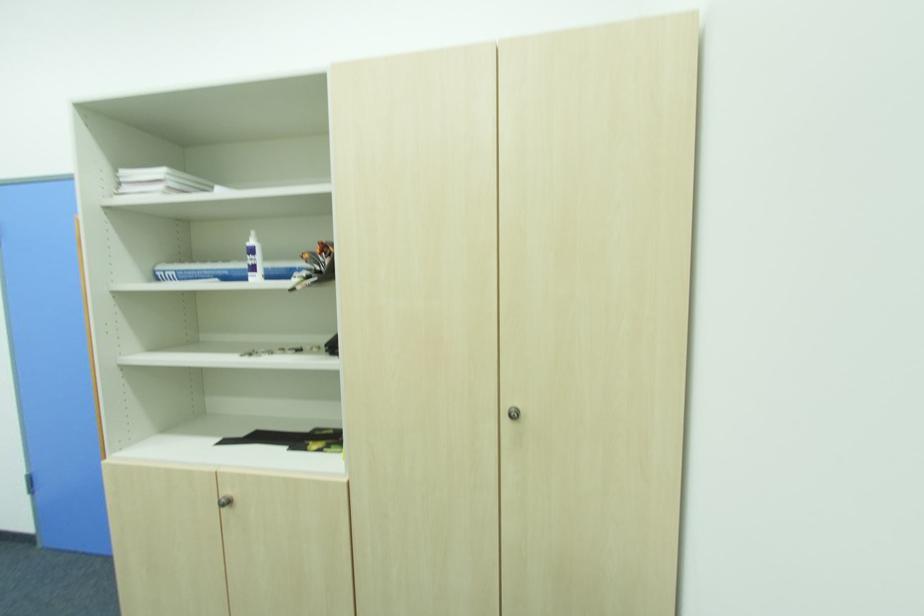
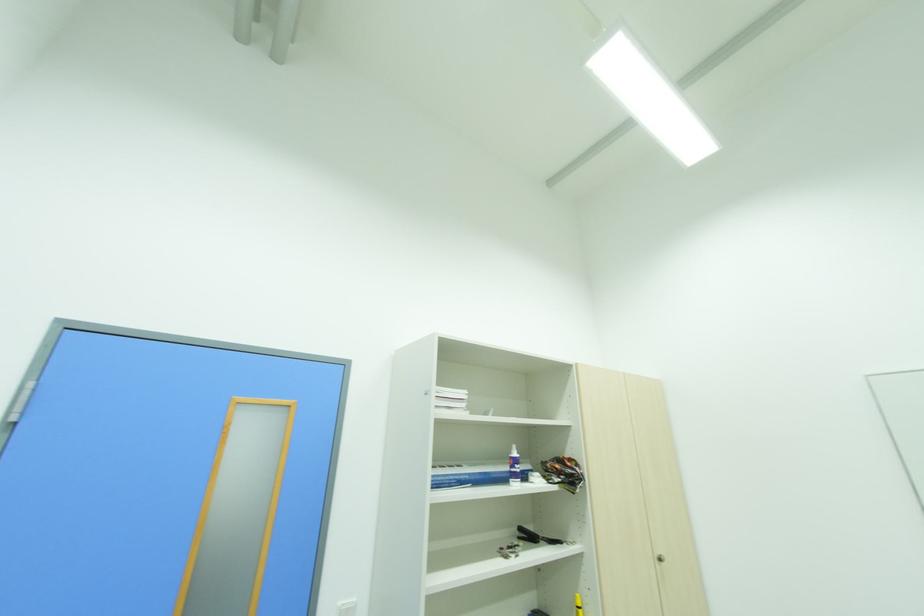
Locate, in the second image, the point that corresponds to (x=254, y=243) in the first image.

(517, 455)